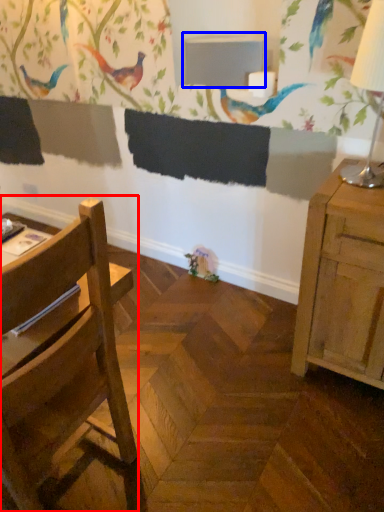
Question: Which object is further to the camera taking this photo, chair (highlighted by a red box) or table (highlighted by a blue box)?

Choices:
 (A) chair
 (B) table

Answer: (B)